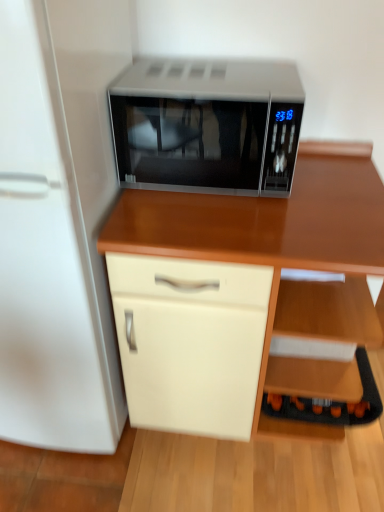
The image size is (384, 512). I want to click on vacant space that's between wooden desk at center and white glossy refrigerator at left, so click(x=188, y=463).